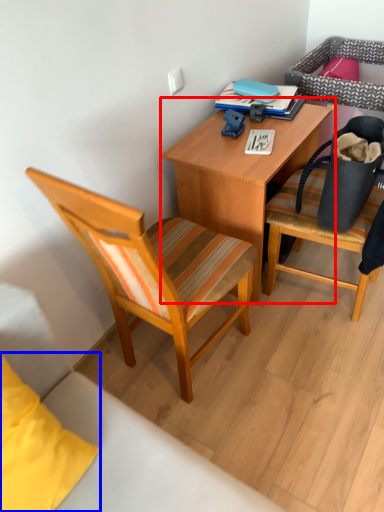
Question: Which point is further to the camera, desk (highlighted by a red box) or pillow (highlighted by a blue box)?

Choices:
 (A) desk
 (B) pillow

Answer: (A)